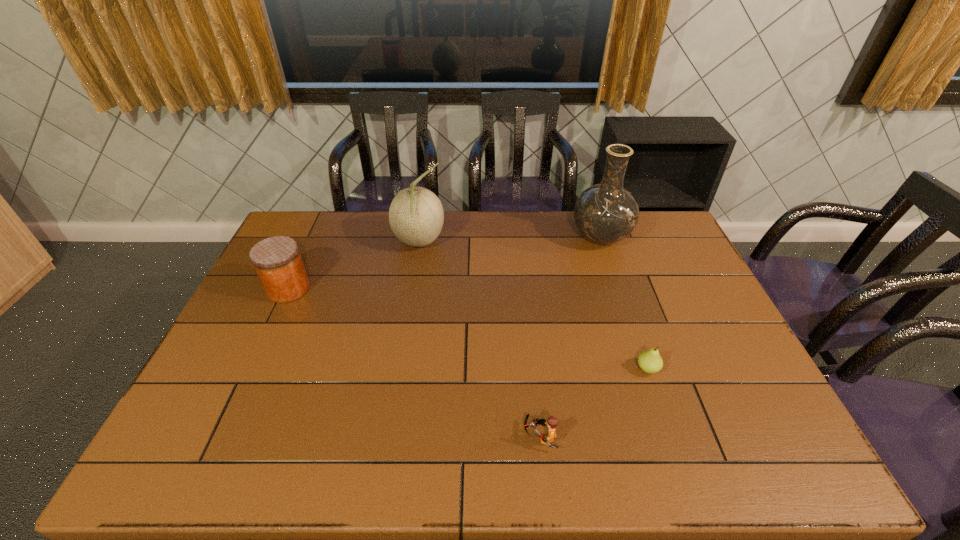
Where is `free area in between the vase and the Lego`? Image resolution: width=960 pixels, height=540 pixels. free area in between the vase and the Lego is located at coordinates coord(570,337).

The height and width of the screenshot is (540, 960). I want to click on vacant space that's between the second tallest object and the vase, so click(510, 240).

Locate an element on the screen. The width and height of the screenshot is (960, 540). empty location between the nearest object and the pear is located at coordinates (593, 403).

Locate an element on the screen. This screenshot has width=960, height=540. free point between the jar and the tallest object is located at coordinates (444, 264).

I want to click on object that can be found as the fourth closest to the third tallest object, so click(650, 361).

Identify which object is the fourth nearest to the Lego. Please provide its 2D coordinates. Your answer should be formatted as a tuple, i.e. [(x, y)], where the tuple contains the x and y coordinates of a point satisfying the conditions above.

[(277, 260)]

I want to click on vacant space that satisfies the following two spatial constraints: 1. on the back side of the tallest object; 2. on the left side of the cantaloup, so click(420, 238).

Where is `vacant space that satisfies the following two spatial constraints: 1. on the front side of the fourth farthest object; 2. on the left side of the fourth object from right to left`? vacant space that satisfies the following two spatial constraints: 1. on the front side of the fourth farthest object; 2. on the left side of the fourth object from right to left is located at coordinates (398, 369).